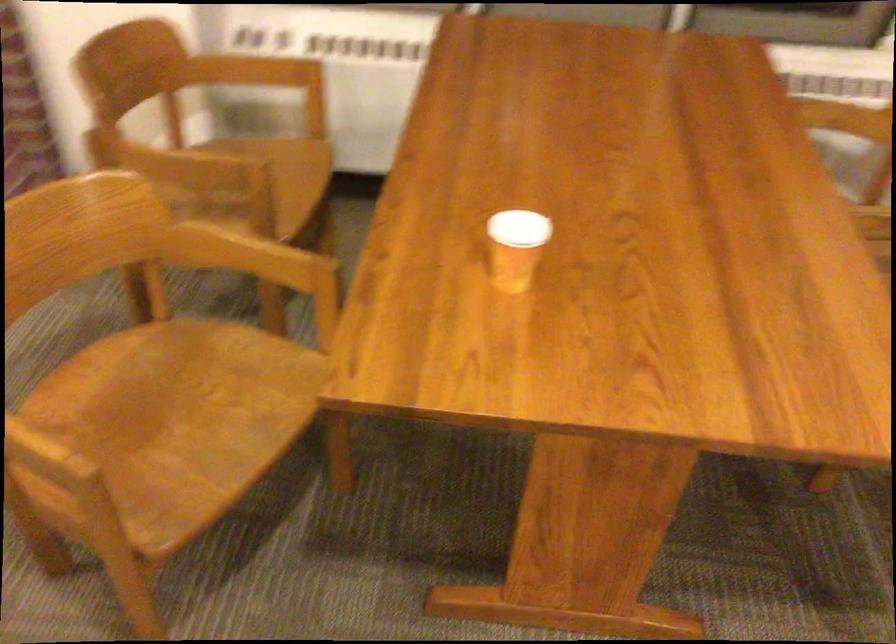
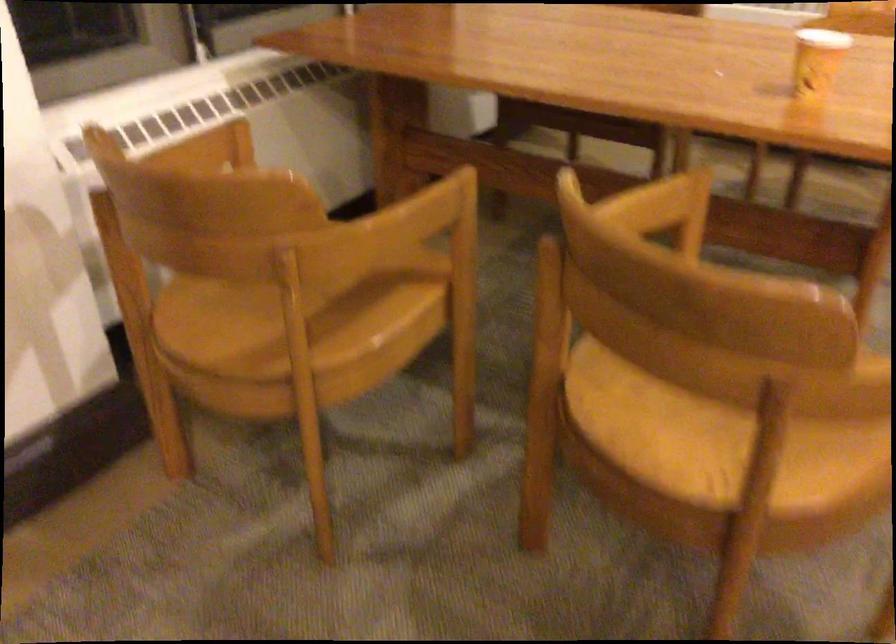
Find the pixel in the second image that matches point 74,399 in the first image.

(704, 433)